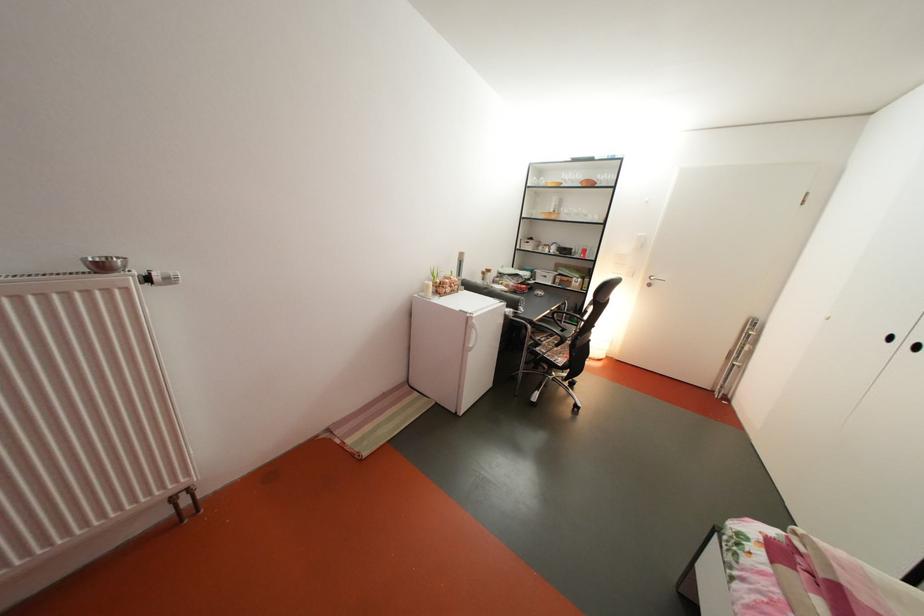
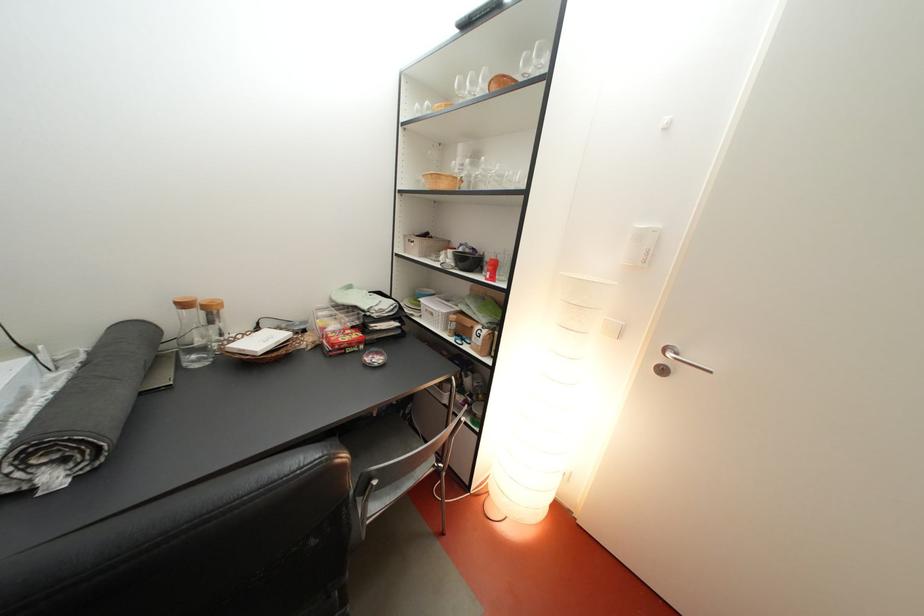
Which direction would the cameraman need to move to produce the second image?

The cameraman walked toward right, forward.